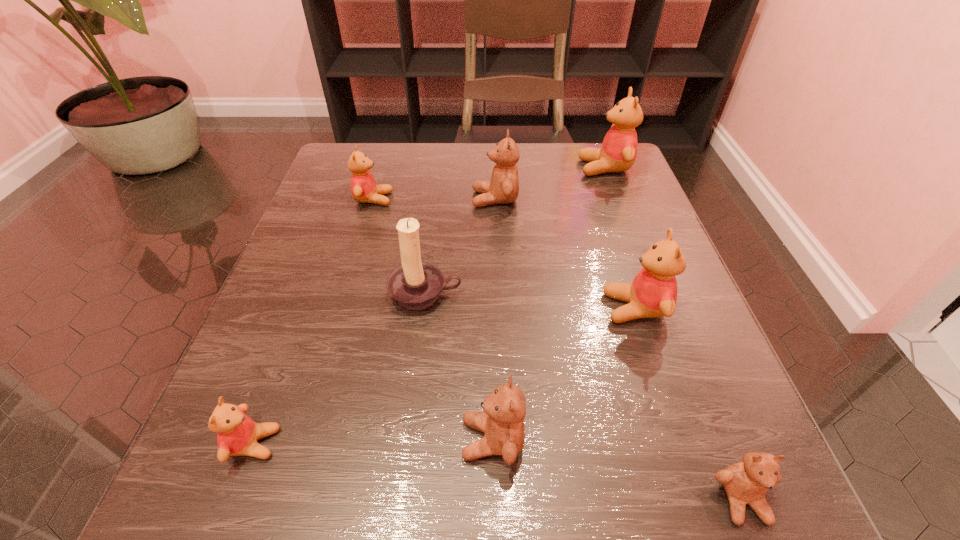
This screenshot has width=960, height=540. I want to click on the tallest teddy bear, so click(618, 152).

Locate an element on the screen. the biggest red teddy bear is located at coordinates (618, 152).

At what (x,y) coordinates should I click in order to perform the action: click on brown candle holder. Please return your answer as a coordinate pair (x, y). Looking at the image, I should click on (415, 285).

At what (x,y) coordinates should I click in order to perform the action: click on candle holder. Please return your answer as a coordinate pair (x, y). Looking at the image, I should click on (415, 285).

Where is `the biggest brown teddy bear`? the biggest brown teddy bear is located at coordinates (503, 188).

Find the location of a particular element. the fourth nearest teddy bear is located at coordinates (653, 293).

This screenshot has height=540, width=960. Find the location of `the third smallest red teddy bear`. the third smallest red teddy bear is located at coordinates (653, 293).

At what (x,y) coordinates should I click in order to perform the action: click on the second smallest red teddy bear. Please return your answer as a coordinate pair (x, y). Image resolution: width=960 pixels, height=540 pixels. Looking at the image, I should click on (363, 186).

Where is `the second smallest brown teddy bear`? the second smallest brown teddy bear is located at coordinates (502, 421).

The width and height of the screenshot is (960, 540). In order to click on the smallest red teddy bear in this screenshot , I will do `click(237, 434)`.